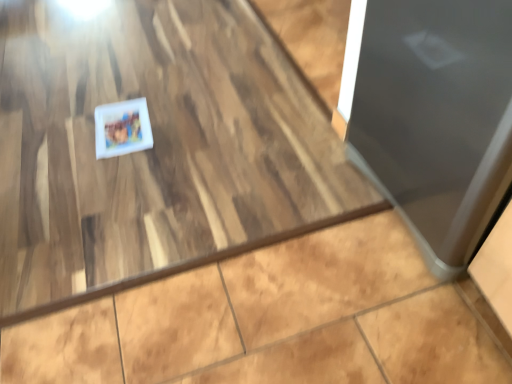
Locate an element on the screen. This screenshot has width=512, height=384. vacant area that lies to the right of white matte postcard at center is located at coordinates (178, 124).